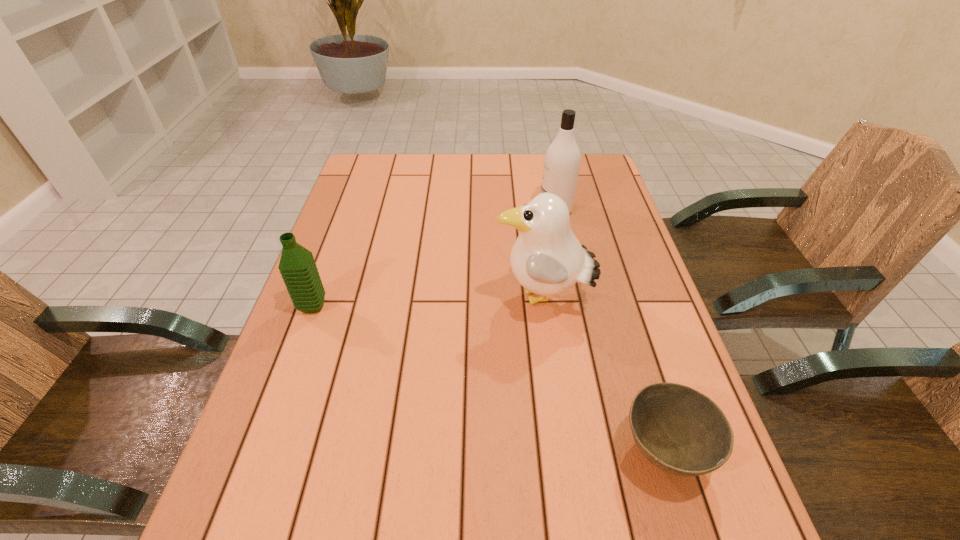
Image resolution: width=960 pixels, height=540 pixels. Find the location of `free space at the right edge of the desktop`. free space at the right edge of the desktop is located at coordinates (589, 234).

Image resolution: width=960 pixels, height=540 pixels. Identify the location of vacant space at the far right corner. (593, 174).

Find the location of `unoccupied area between the bowl and the gull`. unoccupied area between the bowl and the gull is located at coordinates (603, 375).

Where is `vacant area between the leftmost object and the bowl`? This screenshot has height=540, width=960. vacant area between the leftmost object and the bowl is located at coordinates (488, 379).

Locate an element on the screen. The image size is (960, 540). vacant space that's between the gull and the third tallest object is located at coordinates coord(427,302).

Image resolution: width=960 pixels, height=540 pixels. Identify the location of empty location between the leftmost object and the gull. [x=427, y=302].

I want to click on free point between the gull and the leftmost object, so click(427, 302).

This screenshot has height=540, width=960. What are the coordinates of `vacant space in between the leftmost object and the gull` in the screenshot? It's located at (427, 302).

In order to click on free area in between the gull and the water bottle in this screenshot , I will do `click(427, 302)`.

Identify the location of vacant region between the leftmost object and the gull. This screenshot has width=960, height=540. (427, 302).